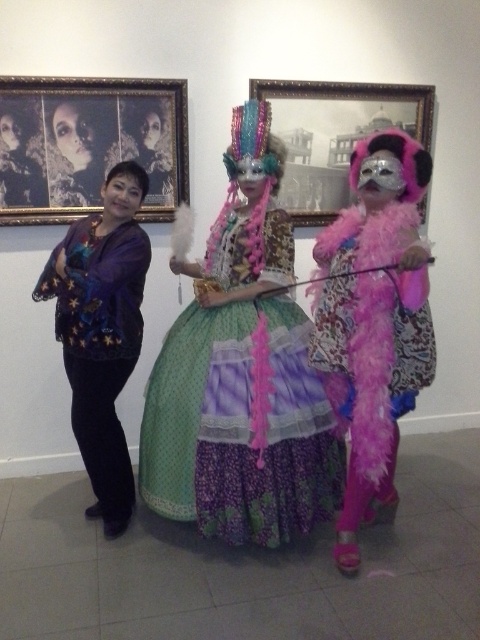
Is fuzzy pink feather boa at right below gold-framed photograph at upper left?

Yes.

Does point (316, 362) come behind point (168, 161)?

No, it is in front of (168, 161).

Who is more distant from viewer, (x=403, y=218) or (x=12, y=179)?

Positioned behind is point (x=12, y=179).

What are the coordinates of `fuzzy pink feather boa at right` in the screenshot? It's located at (372, 372).

Measure the distance from fuzzy pink feather boa at right to matte purple blouse at left.

fuzzy pink feather boa at right and matte purple blouse at left are 37.06 inches apart.

Is point (381, 316) positioned in front of point (93, 269)?

That is True.

Does point (330, 305) lie in front of point (75, 376)?

That is True.

You are a GUI agent. You are given a task and a screenshot of the screen. Output one action in this format:
    pyautogui.click(x=<x>, y=<y>)
    Task: Click on the fuzzy pink feather boa at right
    
    Given the screenshot: What is the action you would take?
    pyautogui.click(x=372, y=372)

Is pastel polka dot dress at center behind gold-framed photograph at upper left?

No, it is not.

Which of these two, pastel polka dot dress at center or gold-framed photograph at upper left, stands taller?

Standing taller between the two is pastel polka dot dress at center.

Does point (194, 355) lie behind point (24, 125)?

No, it is in front of (24, 125).

You are a GUI agent. You are given a task and a screenshot of the screen. Output one action in this format:
    pyautogui.click(x=<x>, y=<y>)
    Task: Click on the pastel polka dot dress at center
    The image size is (480, 640).
    Given the screenshot: What is the action you would take?
    pyautogui.click(x=239, y=428)